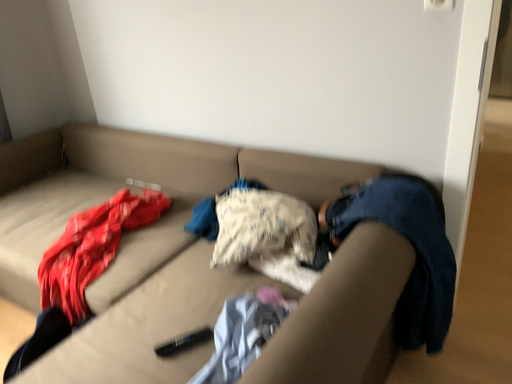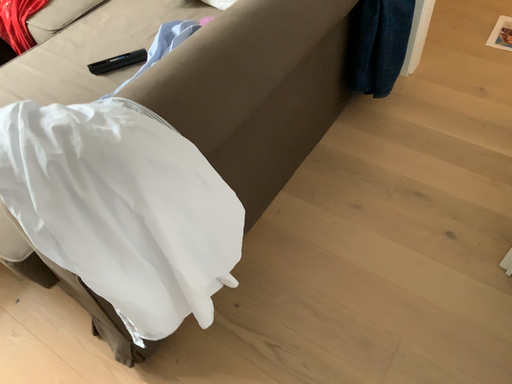
Question: How did the camera likely rotate when shooting the video?

Choices:
 (A) rotated upward
 (B) rotated downward

Answer: (B)